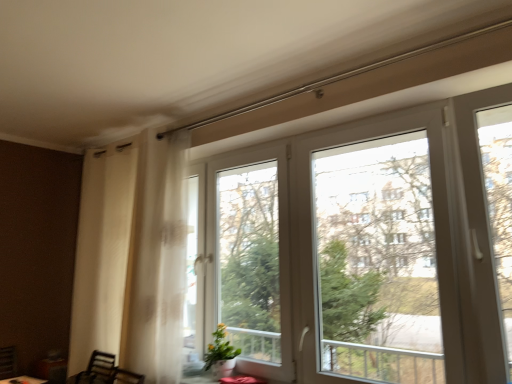
Question: Can you confirm if transparent plastic window at upper center, arranged as the second window screen when viewed from the left, is taller than matte brown round table at lower left?

Choices:
 (A) yes
 (B) no

Answer: (A)

Question: Is transparent plastic window at upper center, arranged as the second window screen when viewed from the left, not within matte brown round table at lower left?

Choices:
 (A) yes
 (B) no

Answer: (A)

Question: Can you confirm if transparent plastic window at upper center, arranged as the second window screen when viewed from the left, is bigger than matte brown round table at lower left?

Choices:
 (A) yes
 (B) no

Answer: (A)

Question: Is transparent plastic window at upper center, arranged as the second window screen when viewed from the left, far from matte brown round table at lower left?

Choices:
 (A) no
 (B) yes

Answer: (B)

Question: Considering the relative sizes of transparent plastic window at upper center, placed as the first window screen when sorted from right to left, and matte brown round table at lower left in the image provided, is transparent plastic window at upper center, placed as the first window screen when sorted from right to left, shorter than matte brown round table at lower left?

Choices:
 (A) no
 (B) yes

Answer: (A)

Question: Does transparent plastic window at upper center, placed as the first window screen when sorted from right to left, come in front of matte brown round table at lower left?

Choices:
 (A) yes
 (B) no

Answer: (A)

Question: Can you confirm if transparent glass window at center, the 1th window screen viewed from the left, is bigger than matte brown round table at lower left?

Choices:
 (A) no
 (B) yes

Answer: (B)

Question: From the image's perspective, would you say transparent glass window at center, the 1th window screen viewed from the left, is positioned over matte brown round table at lower left?

Choices:
 (A) yes
 (B) no

Answer: (A)

Question: Is transparent glass window at center, which is the second window screen in right-to-left order, oriented away from matte brown round table at lower left?

Choices:
 (A) no
 (B) yes

Answer: (A)

Question: Can you confirm if transparent glass window at center, the 1th window screen viewed from the left, is positioned to the left of matte brown round table at lower left?

Choices:
 (A) no
 (B) yes

Answer: (A)

Question: Is the position of transparent glass window at center, which is the second window screen in right-to-left order, more distant than that of matte brown round table at lower left?

Choices:
 (A) yes
 (B) no

Answer: (B)

Question: From a real-world perspective, is transparent glass window at center, which is the second window screen in right-to-left order, positioned over matte brown round table at lower left based on gravity?

Choices:
 (A) no
 (B) yes

Answer: (B)

Question: Can you confirm if transparent glass window at center, the 1th window screen viewed from the left, is shorter than yellow-green leafy plant at lower center?

Choices:
 (A) no
 (B) yes

Answer: (A)